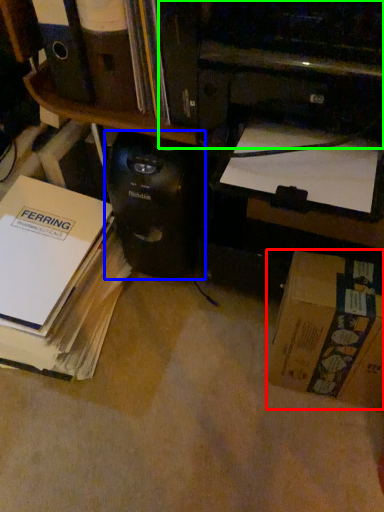
Question: Which object is positioned closest to box (highlighted by a red box)? Select from computer tower (highlighted by a blue box) and printer (highlighted by a green box).

Choices:
 (A) computer tower
 (B) printer

Answer: (A)